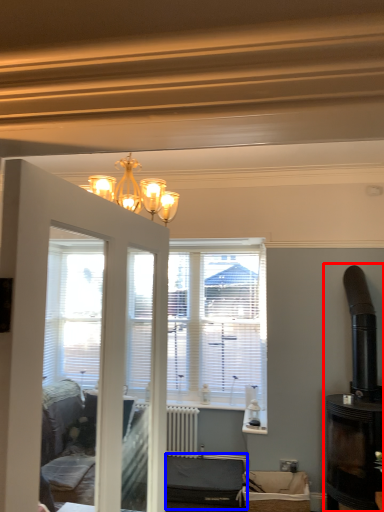
Question: Which object appears closest to the camera in this image, fireplace (highlighted by a red box) or furniture (highlighted by a blue box)?

Choices:
 (A) fireplace
 (B) furniture

Answer: (A)